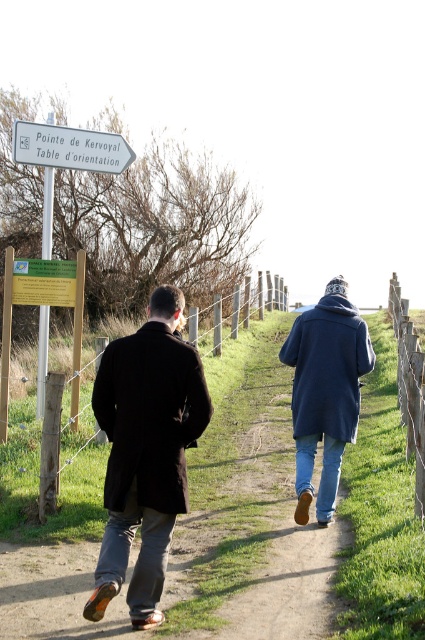
Which is below, dark wool coat at center or navy woolen sweater at center?

dark wool coat at center is lower down.

Who is shorter, dark wool coat at center or navy woolen sweater at center?

navy woolen sweater at center is shorter.

Who is more forward, (125, 563) or (339, 417)?

Point (125, 563)

Identify the location of dark wool coat at center. (325, 392).

Does dark brown coat at center have a smaller size compared to wooden post at right?

Yes, dark brown coat at center is smaller than wooden post at right.

Who is higher up, dark brown coat at center or wooden post at right?

wooden post at right

Locate an element on the screen. This screenshot has width=425, height=640. dark brown coat at center is located at coordinates (146, 452).

Looking at this image, does dark brown coat at center appear over green/yellow plastic sign at upper left?

Incorrect, dark brown coat at center is not positioned above green/yellow plastic sign at upper left.

From the picture: Does dark brown coat at center have a lesser height compared to green/yellow plastic sign at upper left?

No.

The width and height of the screenshot is (425, 640). What do you see at coordinates (146, 452) in the screenshot?
I see `dark brown coat at center` at bounding box center [146, 452].

The height and width of the screenshot is (640, 425). I want to click on dark brown coat at center, so click(x=146, y=452).